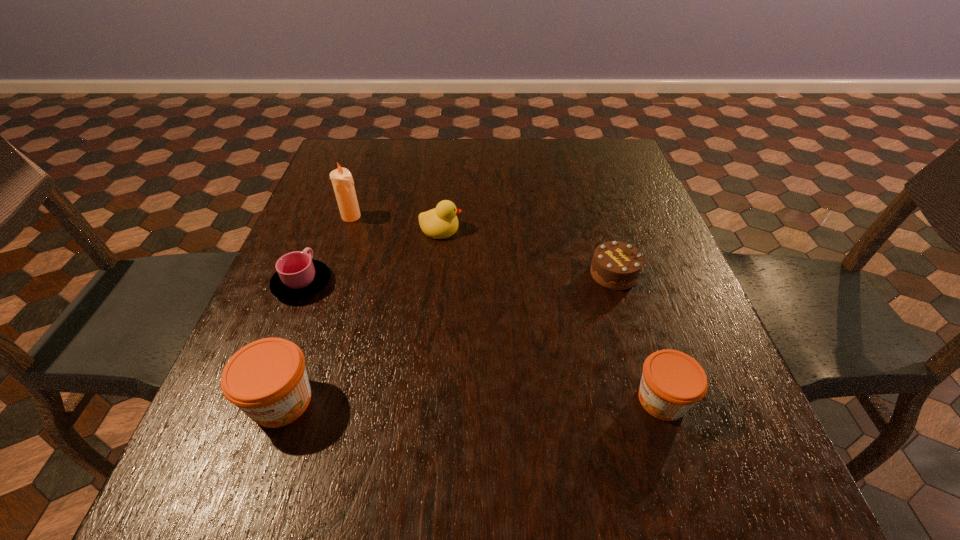
Locate an element on the screen. The width and height of the screenshot is (960, 540). chocolate cake present at the right edge is located at coordinates (615, 265).

The height and width of the screenshot is (540, 960). I want to click on object at the near left corner, so click(267, 379).

Image resolution: width=960 pixels, height=540 pixels. Identify the location of object that is at the near right corner. (672, 382).

Locate an element on the screen. free region at the far edge of the desktop is located at coordinates (440, 143).

In the image, there is a desktop. At what (x,y) coordinates should I click in order to perform the action: click on vacant space at the near edge. Please return your answer as a coordinate pair (x, y). The width and height of the screenshot is (960, 540). Looking at the image, I should click on (521, 398).

Find the location of a particular element. vacant space at the left edge of the desktop is located at coordinates (355, 248).

Image resolution: width=960 pixels, height=540 pixels. Identify the location of vacant position at the right edge of the desktop. (644, 220).

The width and height of the screenshot is (960, 540). In the image, there is a desktop. Identify the location of free space at the far right corner. (582, 151).

You are a GUI agent. You are given a task and a screenshot of the screen. Output one action in this format:
    pyautogui.click(x=<x>, y=<y>)
    Task: Click on the vacant space at the near right corner
    This screenshot has height=540, width=960.
    Given the screenshot: What is the action you would take?
    pyautogui.click(x=721, y=434)

Locate an element on the screen. The width and height of the screenshot is (960, 540). vacant area that lies between the fifth shortest object and the right jam is located at coordinates (471, 400).